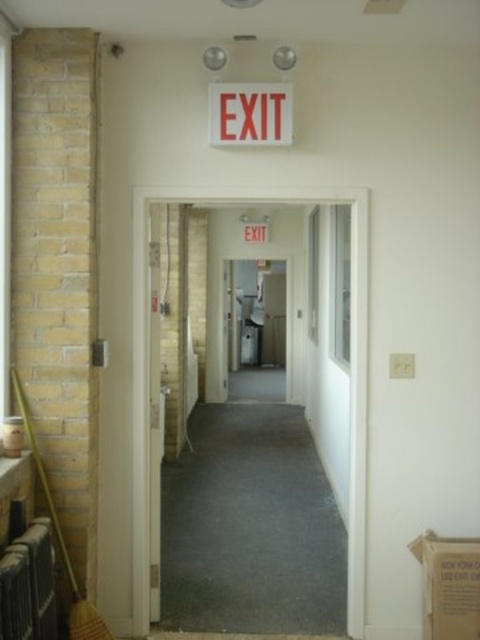
Question: Does smooth gray carpet at center appear on the right side of cardboard box at lower right?

Choices:
 (A) no
 (B) yes

Answer: (A)

Question: Observing the image, what is the correct spatial positioning of smooth gray carpet at center in reference to red plastic exit sign at upper center?

Choices:
 (A) right
 (B) left

Answer: (B)

Question: Estimate the real-world distances between objects in this image. Which object is farther from the cardboard box at lower right?

Choices:
 (A) red plastic exit sign at upper center
 (B) smooth gray carpet at center

Answer: (A)

Question: Which point appears closest to the camera in this image?

Choices:
 (A) click(144, 236)
 (B) click(445, 612)

Answer: (B)

Question: From the image, what is the correct spatial relationship of smooth gray carpet at center in relation to cardboard box at lower right?

Choices:
 (A) right
 (B) left

Answer: (B)

Question: Which point is closer to the camera?

Choices:
 (A) red plastic exit sign at upper center
 (B) cardboard box at lower right
 (C) smooth gray carpet at center

Answer: (B)